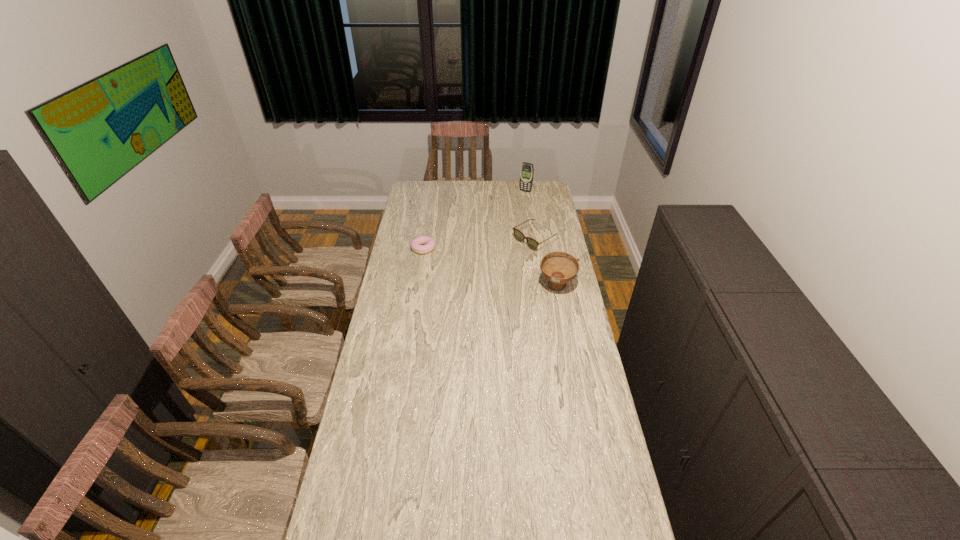
The image size is (960, 540). What are the coordinates of `empty space between the second shortest object and the shortest object` in the screenshot? It's located at (479, 244).

At what (x,y) coordinates should I click in order to perform the action: click on vacant space in between the spectacles and the doughnut. Please return your answer as a coordinate pair (x, y). Image resolution: width=960 pixels, height=540 pixels. Looking at the image, I should click on coord(479,244).

You are a GUI agent. You are given a task and a screenshot of the screen. Output one action in this format:
    pyautogui.click(x=<x>, y=<y>)
    Task: Click on the vacant area that lies between the leftmost object and the cellular telephone
    This screenshot has width=960, height=540.
    Given the screenshot: What is the action you would take?
    pyautogui.click(x=474, y=220)

I want to click on object that is the nearest to the third tallest object, so click(x=559, y=268).

Locate which object is the closest to the doughnut. Please provide its 2D coordinates. Your answer should be formatted as a tuple, i.e. [(x, y)], where the tuple contains the x and y coordinates of a point satisfying the conditions above.

[(519, 236)]

The image size is (960, 540). In order to click on vacant region that satisfies the following two spatial constraints: 1. on the front side of the tallest object; 2. on the right side of the spectacles in this screenshot , I will do `click(533, 239)`.

At what (x,y) coordinates should I click in order to perform the action: click on free space that satisfies the following two spatial constraints: 1. on the front side of the spectacles; 2. on the right side of the cellular telephone. Please return your answer as a coordinate pair (x, y). The height and width of the screenshot is (540, 960). Looking at the image, I should click on (533, 239).